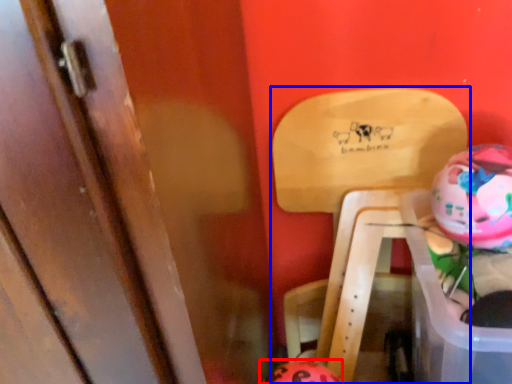
Question: Among these objects, which one is nearest to the camera, piggy bank (highlighted by a red box) or furniture (highlighted by a blue box)?

Choices:
 (A) piggy bank
 (B) furniture

Answer: (B)